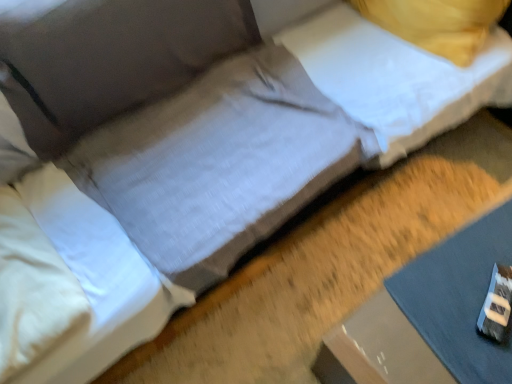
Where is `free point above gray fabric sheet at lower right (from a real-world perspective)`? The width and height of the screenshot is (512, 384). free point above gray fabric sheet at lower right (from a real-world perspective) is located at coordinates (477, 297).